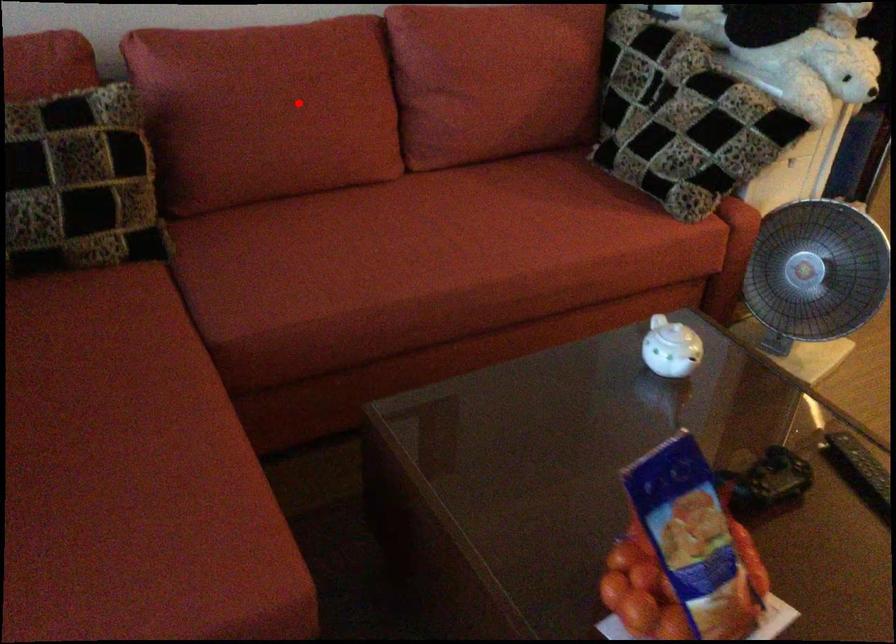
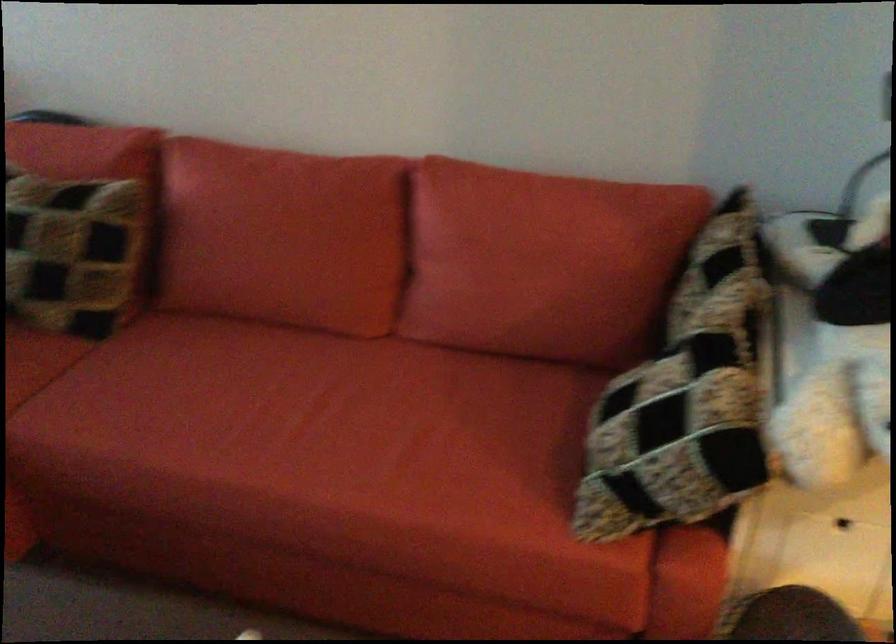
Where in the second image is the point corresponding to the highlighted location from the first image?

(282, 236)